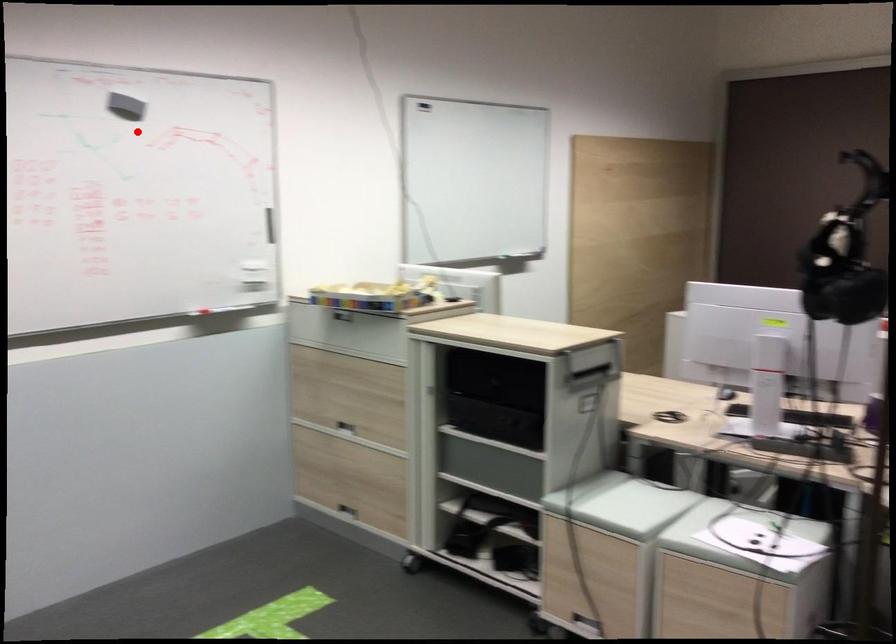
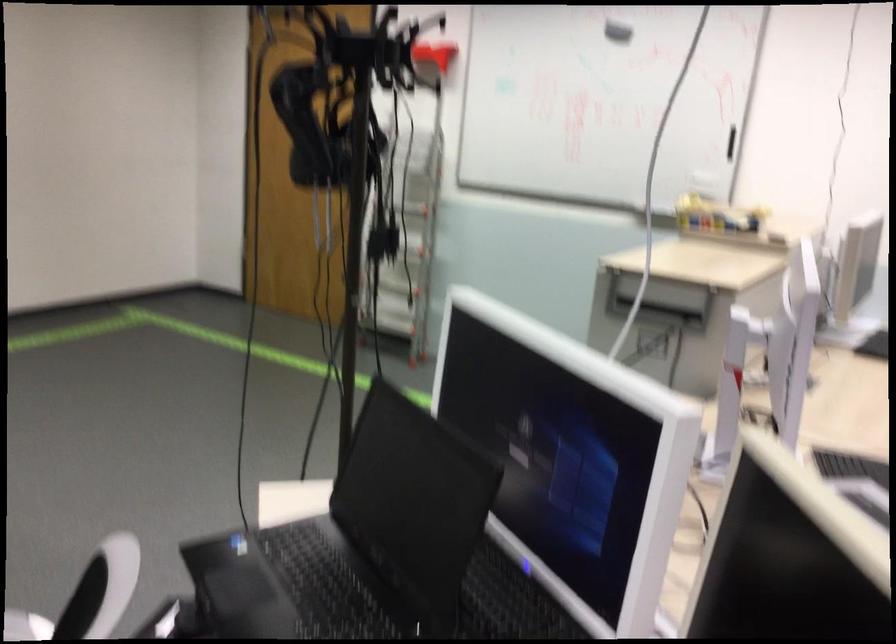
Question: I am providing you with two images of the same scene from different viewpoints. A red point is marked on the first image. At the location where the point appears in image 1, is it still visible in image 2?

Choices:
 (A) Yes
 (B) No

Answer: (A)